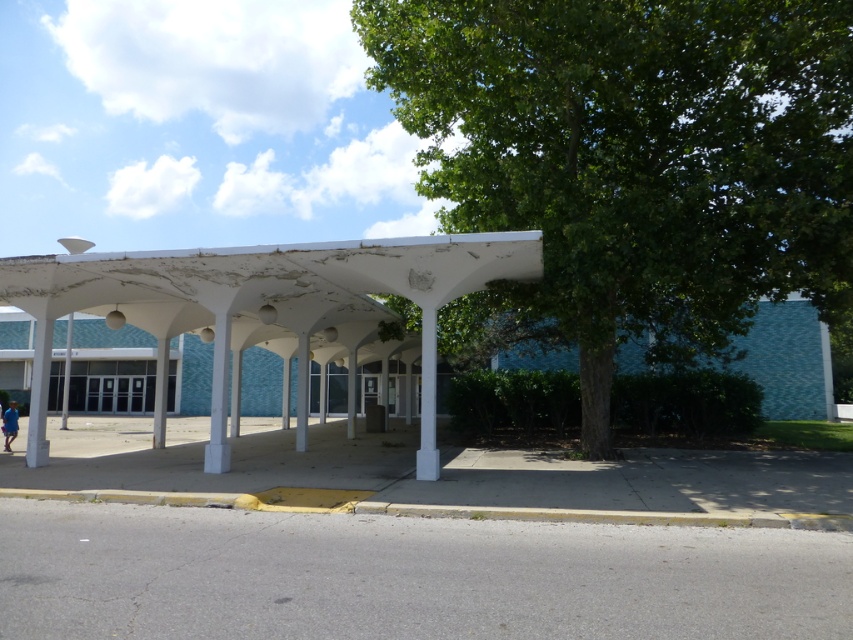
Who is lower down, smooth gray pole at left or blue fabric at left?

blue fabric at left is lower down.

Which is above, smooth gray pole at left or blue fabric at left?

smooth gray pole at left is higher up.

This screenshot has width=853, height=640. What do you see at coordinates (39, 394) in the screenshot?
I see `smooth gray pole at left` at bounding box center [39, 394].

Where is `smooth gray pole at left`? The height and width of the screenshot is (640, 853). smooth gray pole at left is located at coordinates pos(39,394).

Can you confirm if green leafy tree at center is positioned to the left of white smooth column at center?

Incorrect, green leafy tree at center is not on the left side of white smooth column at center.

Is green leafy tree at center above white smooth column at center?

Indeed, green leafy tree at center is positioned over white smooth column at center.

What do you see at coordinates (630, 164) in the screenshot? This screenshot has width=853, height=640. I see `green leafy tree at center` at bounding box center [630, 164].

The height and width of the screenshot is (640, 853). Find the location of `green leafy tree at center`. green leafy tree at center is located at coordinates (630, 164).

Who is more forward, (112, 272) or (38, 362)?

Point (112, 272)

Between white matte pergola at center and smooth gray pole at left, which one has more height?

Standing taller between the two is white matte pergola at center.

Does point (242, 252) lie behind point (42, 394)?

No, (242, 252) is closer to viewer.

At what (x,y) coordinates should I click in order to perform the action: click on white matte pergola at center. Please return your answer as a coordinate pair (x, y). Image resolution: width=853 pixels, height=640 pixels. Looking at the image, I should click on (268, 298).